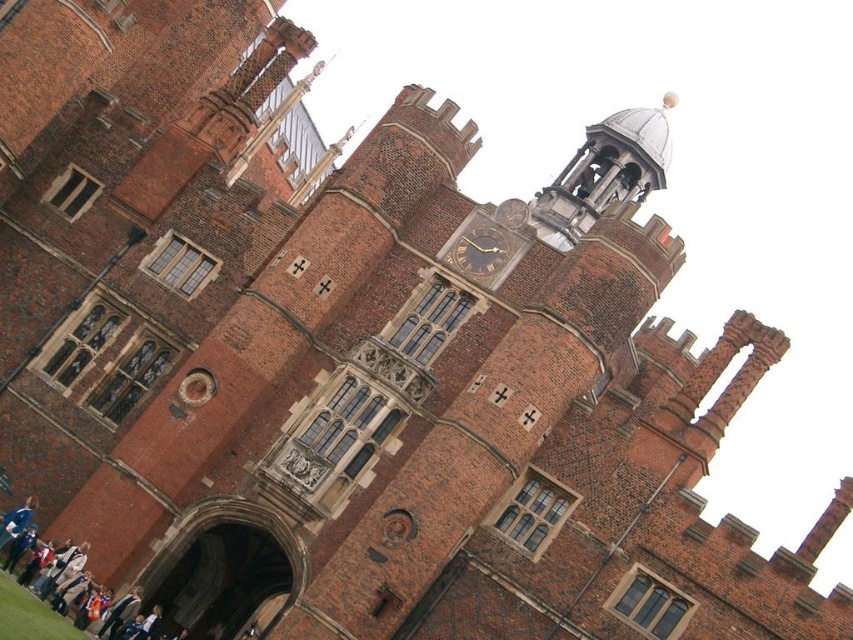
Is white cotton shirt at lower left smaller than gold metallic clock at upper center?

No, white cotton shirt at lower left is not smaller than gold metallic clock at upper center.

Can you confirm if white cotton shirt at lower left is positioned to the right of gold metallic clock at upper center?

In fact, white cotton shirt at lower left is to the left of gold metallic clock at upper center.

The width and height of the screenshot is (853, 640). Identify the location of white cotton shirt at lower left. (30, 614).